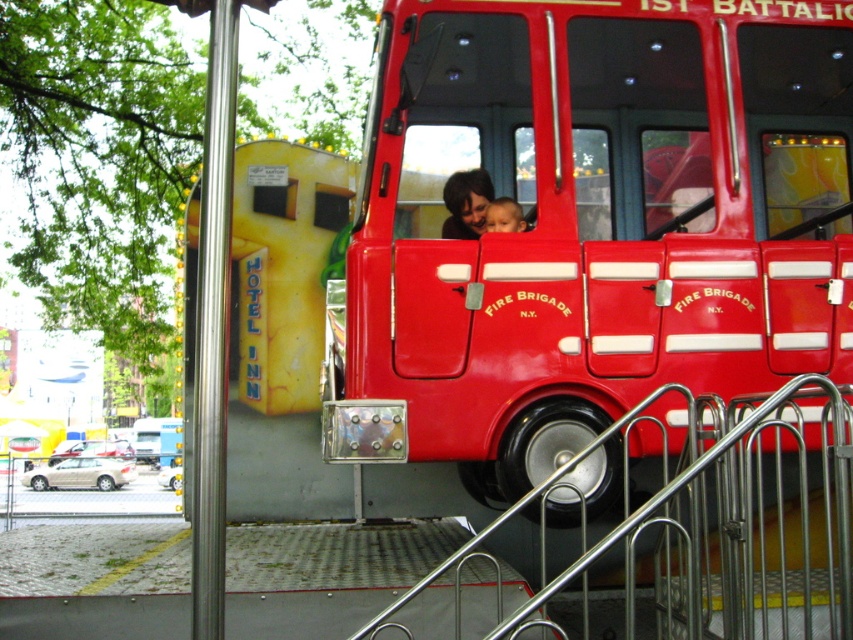
Who is more forward, (811, 524) or (498, 205)?

Point (498, 205) is more forward.

Does point (851, 410) come behind point (518, 225)?

No.

Identify the location of metallic silver rail at lower right. (735, 529).

Based on the photo, between shiny red fire truck at center and metallic silver rail at lower right, which one has more height?

shiny red fire truck at center is taller.

Can you confirm if shiny red fire truck at center is smaller than metallic silver rail at lower right?

No, shiny red fire truck at center is not smaller than metallic silver rail at lower right.

Identify the location of shiny red fire truck at center. (590, 221).

Is shiny red fire truck at center wider than smooth skin face at center?

Correct, the width of shiny red fire truck at center exceeds that of smooth skin face at center.

Can you confirm if shiny red fire truck at center is positioned to the right of smooth skin face at center?

Correct, you'll find shiny red fire truck at center to the right of smooth skin face at center.

The image size is (853, 640). Identify the location of shiny red fire truck at center. (590, 221).